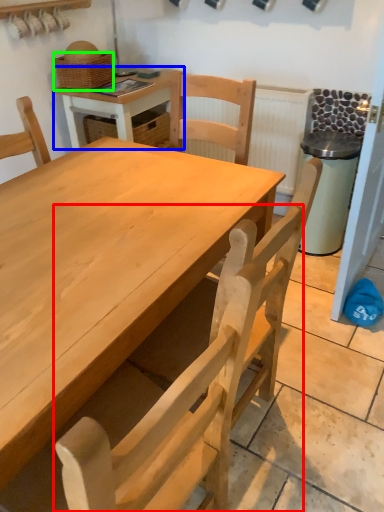
Question: Which object is positioned farthest from chair (highlighted by a red box)? Select from table (highlighted by a blue box) and basket (highlighted by a green box).

Choices:
 (A) table
 (B) basket

Answer: (B)